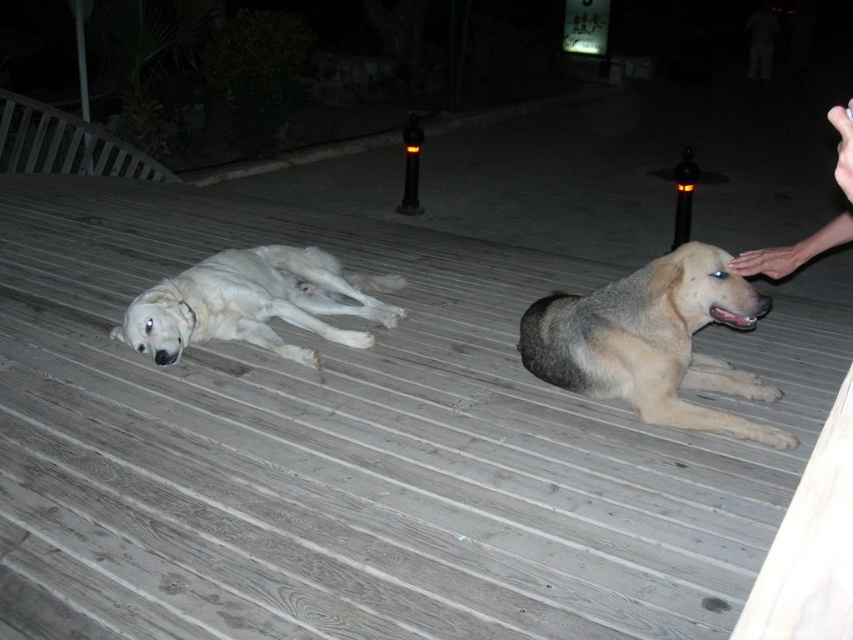
You are a photographer trying to capture a closeup of the gray wood deck at center and the white fur dog at left. Since you can only focus on one subject at a time, which one should you focus on first if you want to ensure the other is in the background?

Since the gray wood deck at center is positioned on the right side of white fur dog at left, you should focus on the white fur dog at left first to have the gray wood deck at center in the background.

From the picture: You are a photographer holding a camera and standing near the gray wood deck at center. You want to place your smooth skin hand at upper right in the frame to take a photo of the dogs. Will your hand cover more area than the deck?

The gray wood deck at center is bigger than the smooth skin hand at upper right, so the hand will not cover more area than the deck.

You are standing on the wooden deck and want to place a small nightlight between the two points, point (427, 564) and point (555, 360). Which point should the nightlight be closer to so it is in front of both dogs?

The nightlight should be closer to point (427, 564) because it is in front of point (555, 360), so placing it near the front point ensures it is in front of both dogs.